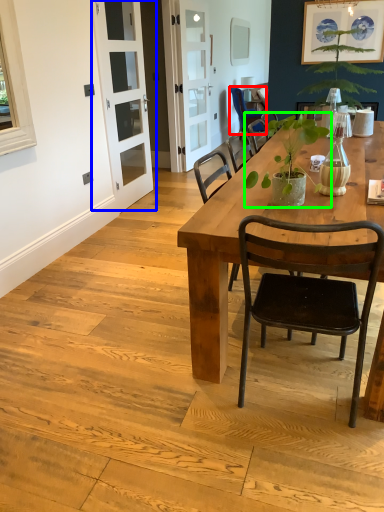
Question: Which object is positioned closest to chair (highlighted by a red box)? Select from screen door (highlighted by a blue box) and houseplant (highlighted by a green box).

Choices:
 (A) screen door
 (B) houseplant

Answer: (A)